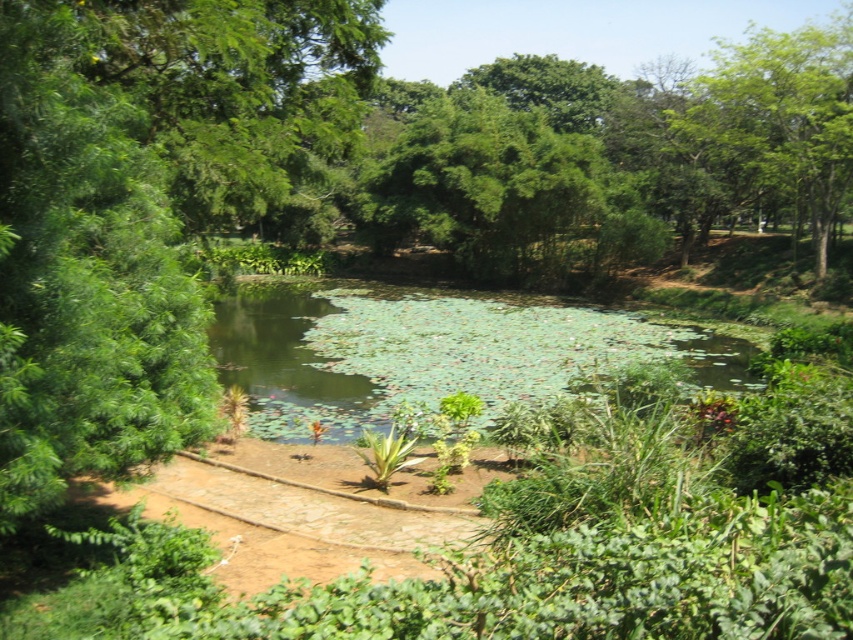
You are a gardener planning to trim the green leafy tree at upper right and the green leafy water at center. Which object requires more effort to maintain based on their sizes?

The green leafy tree at upper right requires more effort to maintain since it is larger than the green leafy water at center.

You are standing on the stone pathway and want to reach the green leafy tree at upper right. Which direction should you walk to get closer to the tree while avoiding the green leafy water at center?

You should walk towards the upper right direction to reach the green leafy tree at upper right while avoiding the green leafy water at center, which is located below the tree.